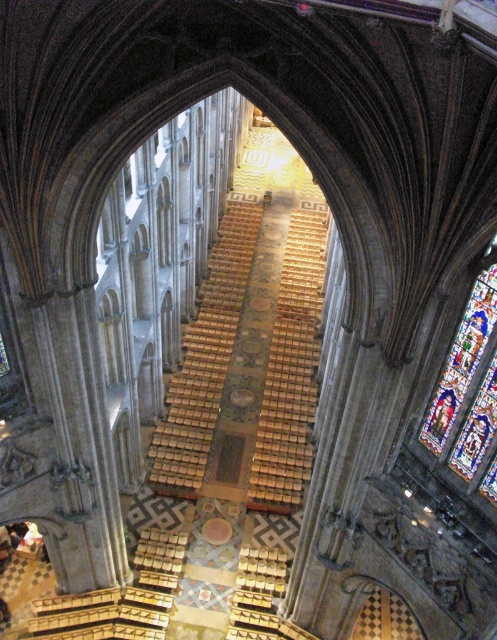
Does wooden at center have a larger size compared to stained glass at right?

Correct, wooden at center is larger in size than stained glass at right.

You are a GUI agent. You are given a task and a screenshot of the screen. Output one action in this format:
    pyautogui.click(x=<x>, y=<y>)
    Task: Click on the wooden at center
    This screenshot has width=497, height=640.
    Given the screenshot: What is the action you would take?
    (x=204, y=358)

Between wooden pews at center and wooden at center, which one is positioned higher?

Positioned higher is wooden at center.

Is wooden pews at center wider than wooden at center?

Correct, the width of wooden pews at center exceeds that of wooden at center.

Between point (288, 273) and point (214, 248), which one is positioned behind?

The point (214, 248) is more distant.

You are a GUI agent. You are given a task and a screenshot of the screen. Output one action in this format:
    pyautogui.click(x=<x>, y=<y>)
    Task: Click on the wooden pews at center
    
    Given the screenshot: What is the action you would take?
    pyautogui.click(x=291, y=372)

Which is below, wooden pews at center or stained glass at right?

stained glass at right is below.

Is wooden pews at center positioned behind stained glass at right?

Yes.

Is point (315, 385) behind point (449, 390)?

Yes.

You are a GUI agent. You are given a task and a screenshot of the screen. Output one action in this format:
    pyautogui.click(x=<x>, y=<y>)
    Task: Click on the wooden pews at center
    
    Given the screenshot: What is the action you would take?
    pyautogui.click(x=291, y=372)